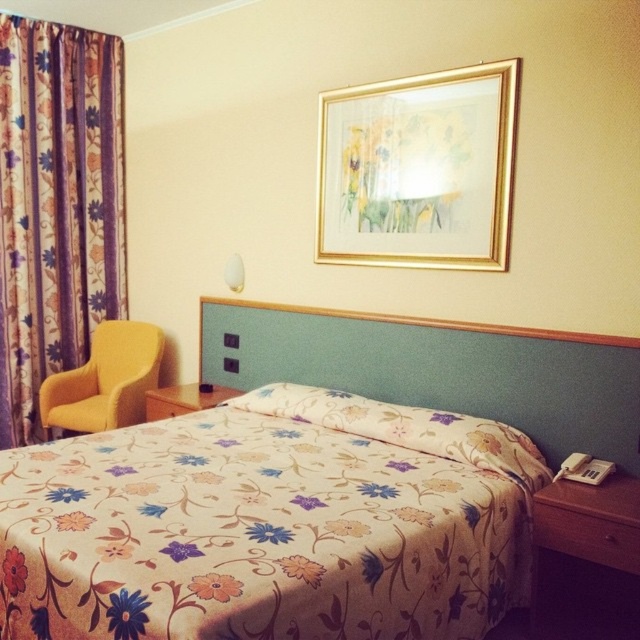
Who is taller, floral-patterned fabric at center or textured fabric headboard at center?

Standing taller between the two is textured fabric headboard at center.

Which is more to the left, floral-patterned fabric at center or textured fabric headboard at center?

floral-patterned fabric at center

Who is more distant from viewer, (204, 620) or (340, 320)?

Positioned behind is point (340, 320).

Find the location of `floral-patterned fabric at center`. floral-patterned fabric at center is located at coordinates (259, 532).

Between floral-patterned fabric at center and white plastic lampshade at upper center, which one is positioned higher?

Positioned higher is white plastic lampshade at upper center.

Who is positioned more to the right, floral-patterned fabric at center or white plastic lampshade at upper center?

From the viewer's perspective, floral-patterned fabric at center appears more on the right side.

In order to click on floral-patterned fabric at center in this screenshot , I will do `click(259, 532)`.

Does point (234, 596) lie behind point (4, 556)?

No, (234, 596) is closer to viewer.

Is orange fabric flower at center below floral fabric bedspread at lower left?

Actually, orange fabric flower at center is above floral fabric bedspread at lower left.

Who is more forward, [218,588] or [4,579]?

Point [218,588]

Locate an element on the screen. The width and height of the screenshot is (640, 640). orange fabric flower at center is located at coordinates (216, 586).